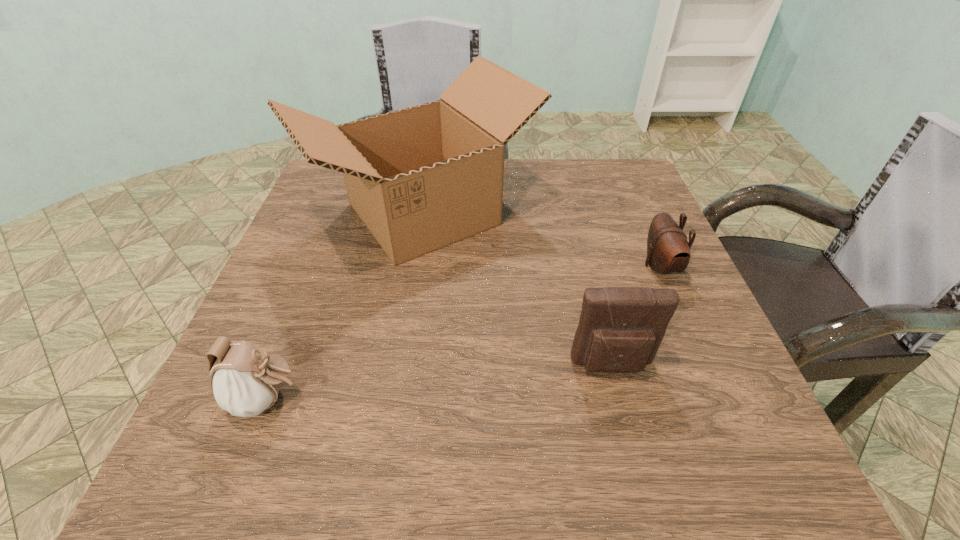
Locate an element on the screen. The image size is (960, 540). free location located with the flap open on the shortest pouch is located at coordinates (468, 266).

Locate an element on the screen. The height and width of the screenshot is (540, 960). vacant space located with the flap open on the shortest pouch is located at coordinates (591, 266).

Locate an element on the screen. The height and width of the screenshot is (540, 960). vacant area situated 0.350m with the flap open on the shortest pouch is located at coordinates (477, 266).

Identify the location of object present at the far edge. The width and height of the screenshot is (960, 540). (422, 178).

Locate an element on the screen. box present at the left edge is located at coordinates (422, 178).

Identify the location of pouch situated at the left edge. The image size is (960, 540). point(245,381).

At what (x,y) coordinates should I click in order to perform the action: click on object present at the far left corner. Please return your answer as a coordinate pair (x, y). Looking at the image, I should click on (422, 178).

I want to click on vacant point at the far edge, so click(538, 163).

I want to click on free space at the left edge of the desktop, so click(x=310, y=219).

Find the location of a particular element. The height and width of the screenshot is (540, 960). free space at the right edge of the desktop is located at coordinates (682, 285).